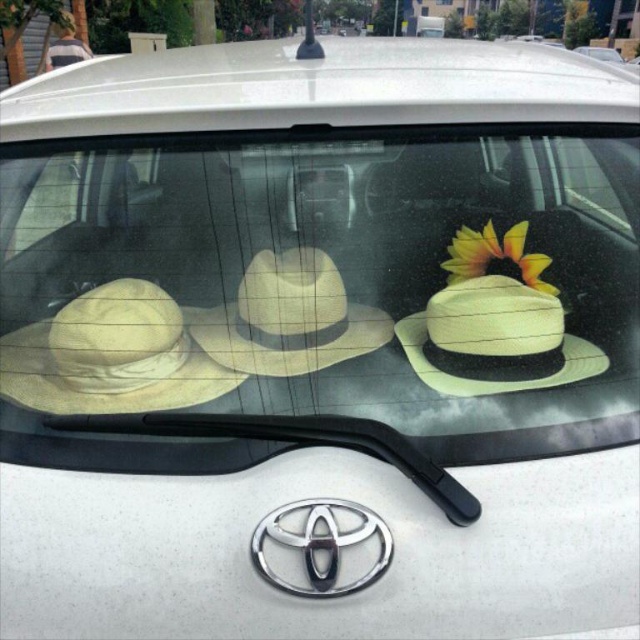
Between beige straw hat at center and yellow matte flower at upper right, which one is positioned higher?

yellow matte flower at upper right is higher up.

The image size is (640, 640). I want to click on beige straw hat at center, so click(x=493, y=380).

This screenshot has height=640, width=640. What do you see at coordinates (289, 317) in the screenshot? I see `natural straw cowboy hat at center` at bounding box center [289, 317].

Locate an element on the screen. The width and height of the screenshot is (640, 640). natural straw cowboy hat at center is located at coordinates (289, 317).

Which is behind, point (225, 365) or point (579, 356)?

The point (225, 365) is behind.

You are a GUI agent. You are given a task and a screenshot of the screen. Output one action in this format:
    pyautogui.click(x=<x>, y=<y>)
    Task: Click on the natural straw cowboy hat at center
    The height and width of the screenshot is (640, 640).
    Given the screenshot: What is the action you would take?
    pyautogui.click(x=289, y=317)

Does beige straw cowboy hat at left have a larger size compared to natural straw cowboy hat at center?

Yes, beige straw cowboy hat at left is bigger than natural straw cowboy hat at center.

Is point (156, 364) farther from viewer compared to point (275, 365)?

Yes.

Who is more forward, (x=84, y=387) or (x=298, y=330)?

Point (x=298, y=330)

Locate an element on the screen. beige straw cowboy hat at left is located at coordinates (109, 355).